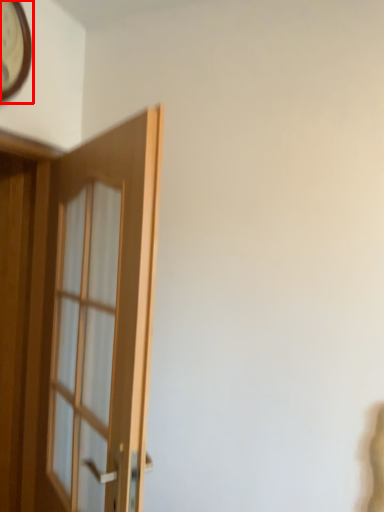
Question: Observing the image, what is the correct spatial positioning of clock (annotated by the red box) in reference to door?

Choices:
 (A) right
 (B) left

Answer: (B)